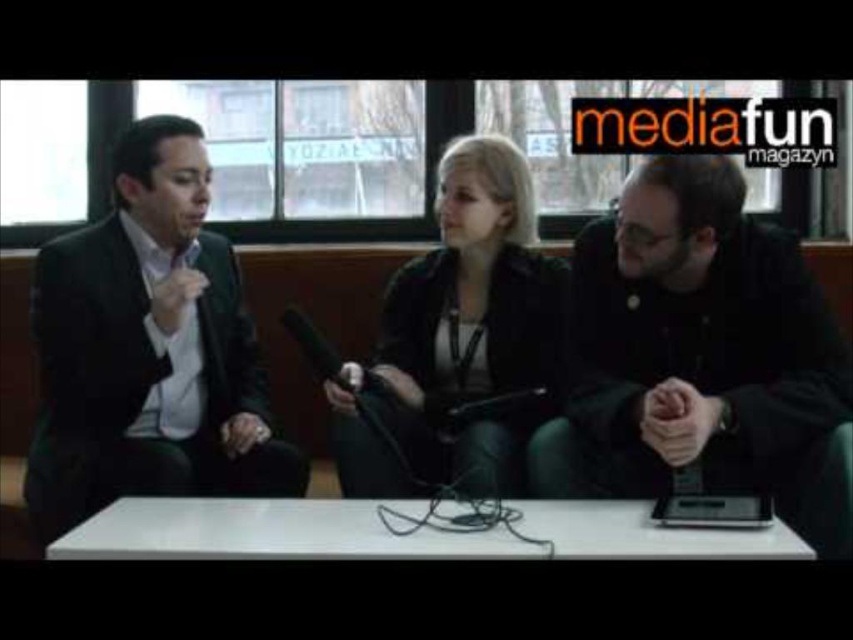
Question: Is black matte jacket at right below black leather jacket at center?

Choices:
 (A) yes
 (B) no

Answer: (A)

Question: Can you confirm if black suit at left is positioned to the left of black leather jacket at center?

Choices:
 (A) yes
 (B) no

Answer: (A)

Question: Is black matte jacket at right positioned behind black suit at left?

Choices:
 (A) no
 (B) yes

Answer: (A)

Question: Which is farther from the black leather jacket at center?

Choices:
 (A) black matte jacket at right
 (B) white glossy table at center
 (C) black suit at left

Answer: (C)

Question: Which point appears farthest from the camera in this image?

Choices:
 (A) (646, 316)
 (B) (427, 579)

Answer: (A)

Question: Considering the real-world distances, which object is farthest from the black matte jacket at right?

Choices:
 (A) black leather jacket at center
 (B) white glossy table at center
 (C) black suit at left

Answer: (C)